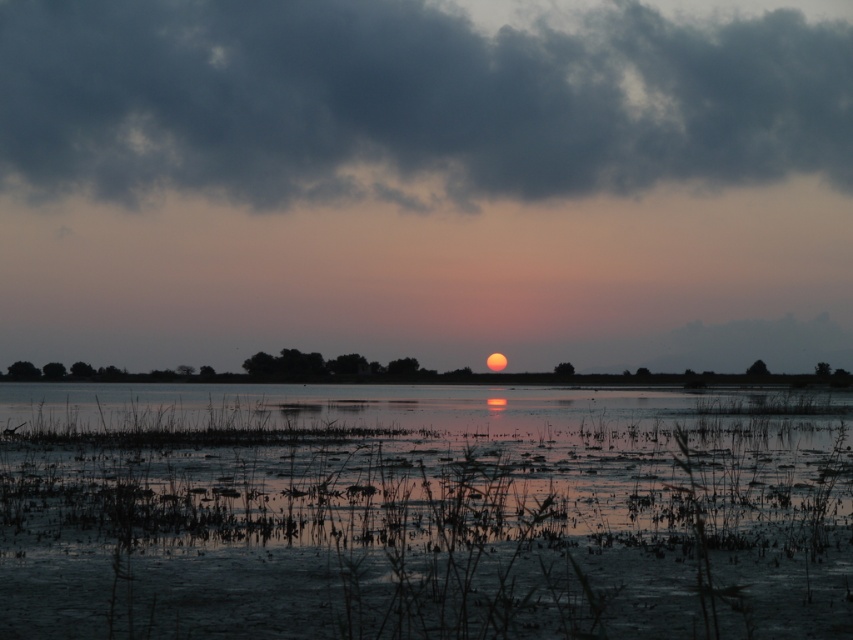
Question: Is reflective wetland at center below dark gray cloud at upper center?

Choices:
 (A) yes
 (B) no

Answer: (A)

Question: Is reflective wetland at center bigger than dark gray cloud at upper center?

Choices:
 (A) yes
 (B) no

Answer: (B)

Question: Is reflective wetland at center bigger than dark gray cloud at upper center?

Choices:
 (A) no
 (B) yes

Answer: (A)

Question: Which of the following is the farthest from the observer?

Choices:
 (A) reflective wetland at center
 (B) dark gray cloud at upper center

Answer: (B)

Question: Which of the following is the farthest from the observer?

Choices:
 (A) (630, 16)
 (B) (378, 612)

Answer: (A)

Question: Which point is closer to the camera?

Choices:
 (A) dark gray cloud at upper center
 (B) reflective wetland at center

Answer: (B)